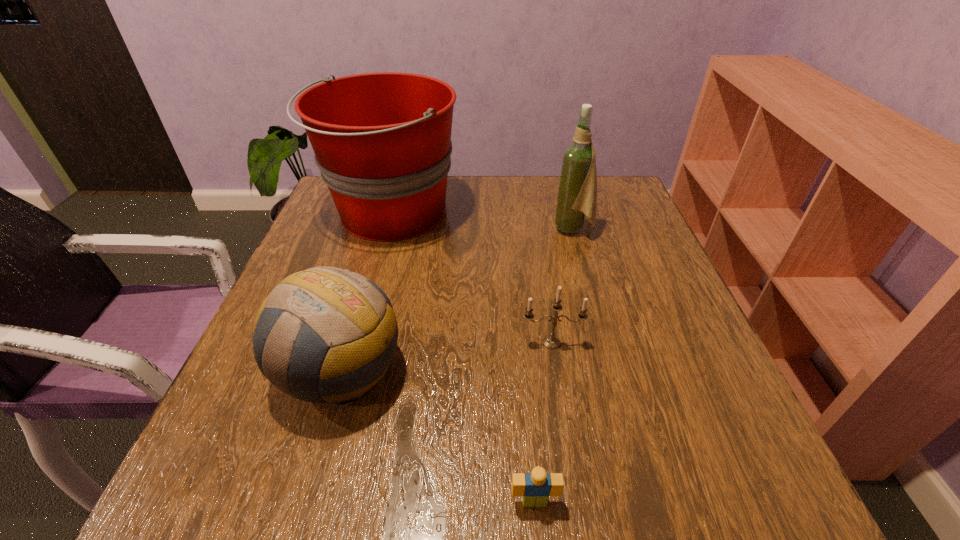
I want to click on unoccupied position between the second shortest object and the bucket, so click(471, 278).

Find the location of a particular element. The image size is (960, 540). empty space between the third tallest object and the wine bottle is located at coordinates (457, 299).

Where is `unoccupied area between the third tallest object and the candle`? unoccupied area between the third tallest object and the candle is located at coordinates (446, 356).

At what (x,y) coordinates should I click in order to perform the action: click on vacant area that lies between the volleyball and the candle. Please return your answer as a coordinate pair (x, y). The width and height of the screenshot is (960, 540). Looking at the image, I should click on (446, 356).

At what (x,y) coordinates should I click in order to perform the action: click on object that is the second closest to the nearest object. Please return your answer as a coordinate pair (x, y). Looking at the image, I should click on (552, 342).

Locate which object ranks third in proximity to the volleyball. Please provide its 2D coordinates. Your answer should be formatted as a tuple, i.e. [(x, y)], where the tuple contains the x and y coordinates of a point satisfying the conditions above.

[(552, 342)]

Locate an element on the screen. The image size is (960, 540). blank area in the image that satisfies the following two spatial constraints: 1. on the front-facing side of the wine bottle; 2. on the face of the shortest object is located at coordinates coord(649,501).

Where is `free space that satisfies the following two spatial constraints: 1. on the back side of the third shortest object; 2. on the left side of the second shortest object`? The width and height of the screenshot is (960, 540). free space that satisfies the following two spatial constraints: 1. on the back side of the third shortest object; 2. on the left side of the second shortest object is located at coordinates (348, 342).

In order to click on vacant area that satisfies the following two spatial constraints: 1. on the front-facing side of the wine bottle; 2. on the front side of the fourth tallest object in this screenshot , I will do `click(605, 342)`.